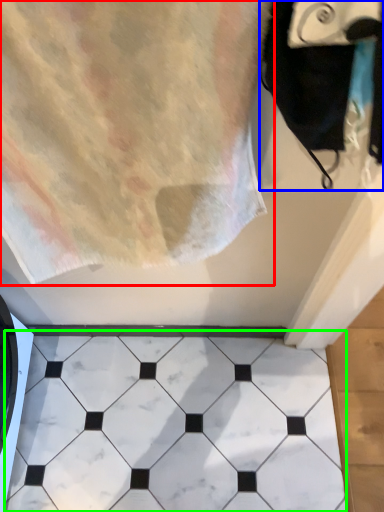
Question: Which object is positioned closest to towel (highlighted by a red box)? Select from bath towel (highlighted by a blue box) and marble (highlighted by a green box).

Choices:
 (A) bath towel
 (B) marble

Answer: (A)